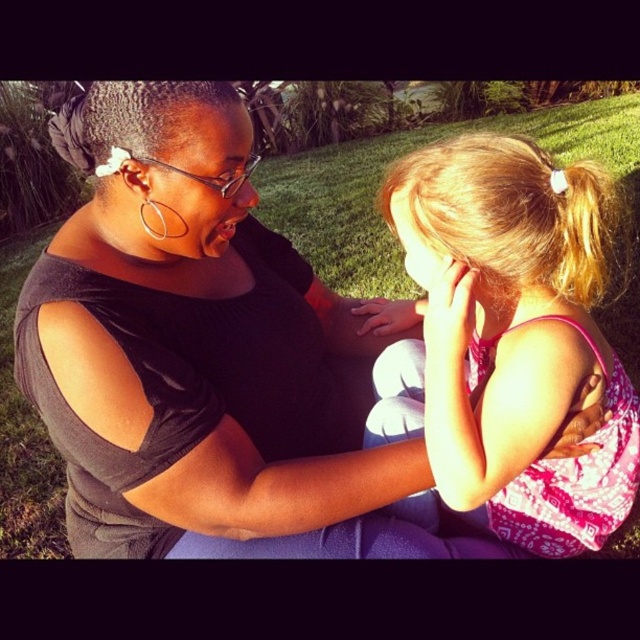
Question: Does pink fabric dress at center have a smaller size compared to green grass at center?

Choices:
 (A) yes
 (B) no

Answer: (B)

Question: Which of the following is the closest to the observer?

Choices:
 (A) (211, 378)
 (B) (541, 440)

Answer: (B)

Question: Which object is farther from the camera taking this photo?

Choices:
 (A) green grass at center
 (B) pink fabric dress at center

Answer: (B)

Question: Is pink fabric dress at center smaller than green grass at center?

Choices:
 (A) yes
 (B) no

Answer: (B)

Question: Can you confirm if pink fabric dress at center is positioned to the right of green grass at center?

Choices:
 (A) yes
 (B) no

Answer: (A)